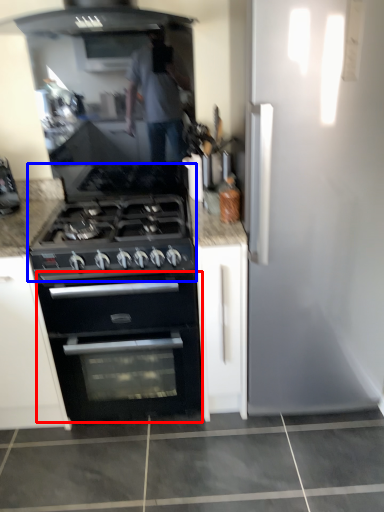
Question: Which object is closer to the camera taking this photo, oven (highlighted by a red box) or gas stove (highlighted by a blue box)?

Choices:
 (A) oven
 (B) gas stove

Answer: (B)